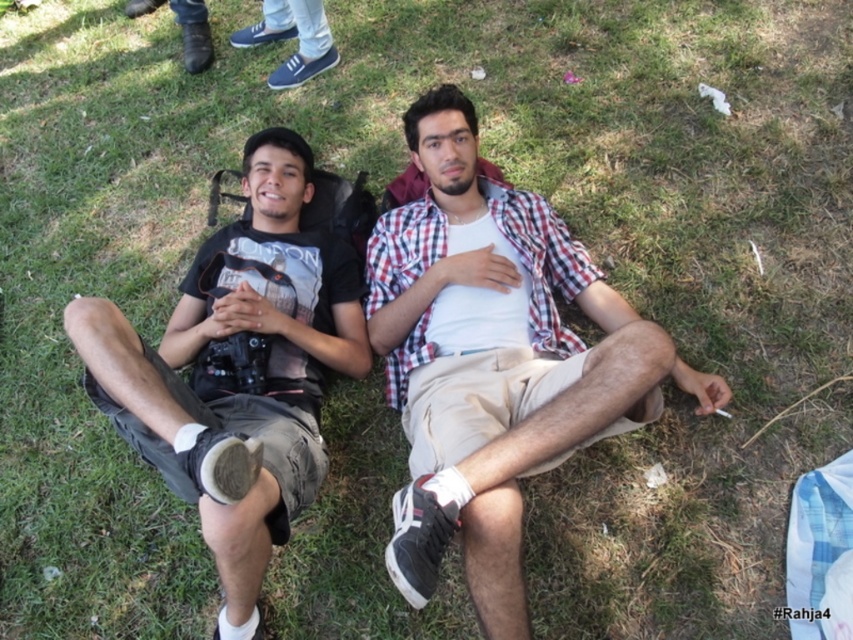
In the scene shown: You are standing in the grassy area where the two people are lying. You want to place a small flag at point A and point B. Point A is at coordinates point (564,298) and point B is at coordinates point (223,392). Which point is closer to you, point A or point B?

Point A at coordinates point (564,298) is closer to you because it is further to the viewer than point B at coordinates point (223,392).

You are standing at the point with coordinates [494,360] in the image. What object is exactly at this location?

The point at [494,360] is exactly at the checkered fabric shirt at center.